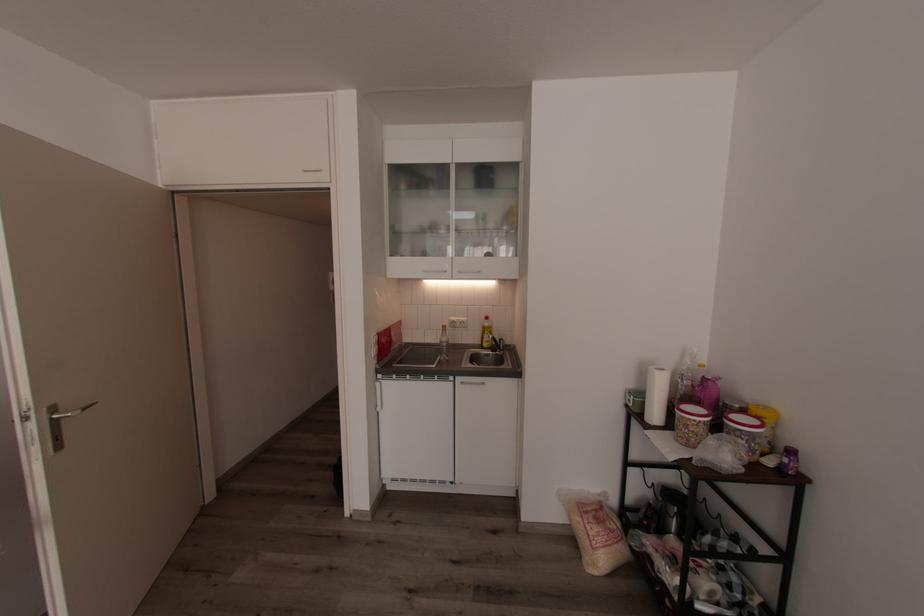
Image resolution: width=924 pixels, height=616 pixels. Find the location of `white cabinet handle`. white cabinet handle is located at coordinates (433, 275).